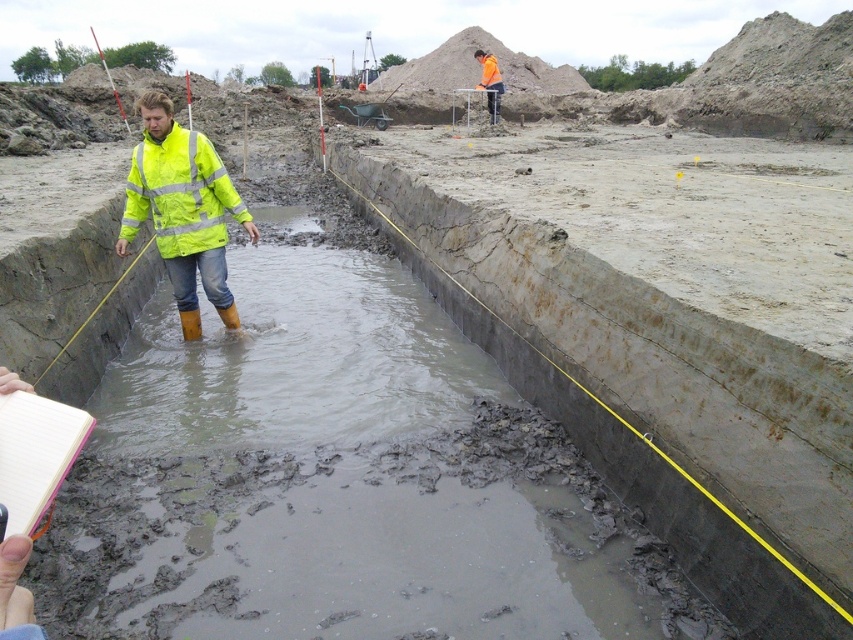
Question: Does neon yellow reflective jacket at center have a lesser width compared to orange reflective jacket at upper center?

Choices:
 (A) no
 (B) yes

Answer: (B)

Question: Among these points, which one is farthest from the camera?

Choices:
 (A) (192, 243)
 (B) (183, 176)

Answer: (A)

Question: Which is farther from the neon yellow reflective jacket at center?

Choices:
 (A) orange reflective jacket at upper center
 (B) high visibility yellow jacket at center

Answer: (A)

Question: Is high visibility yellow jacket at center behind orange reflective jacket at upper center?

Choices:
 (A) yes
 (B) no

Answer: (B)

Question: Which object appears farthest from the camera in this image?

Choices:
 (A) orange reflective jacket at upper center
 (B) high visibility yellow jacket at center

Answer: (A)

Question: Does neon yellow reflective jacket at center have a lesser width compared to orange reflective jacket at upper center?

Choices:
 (A) no
 (B) yes

Answer: (B)